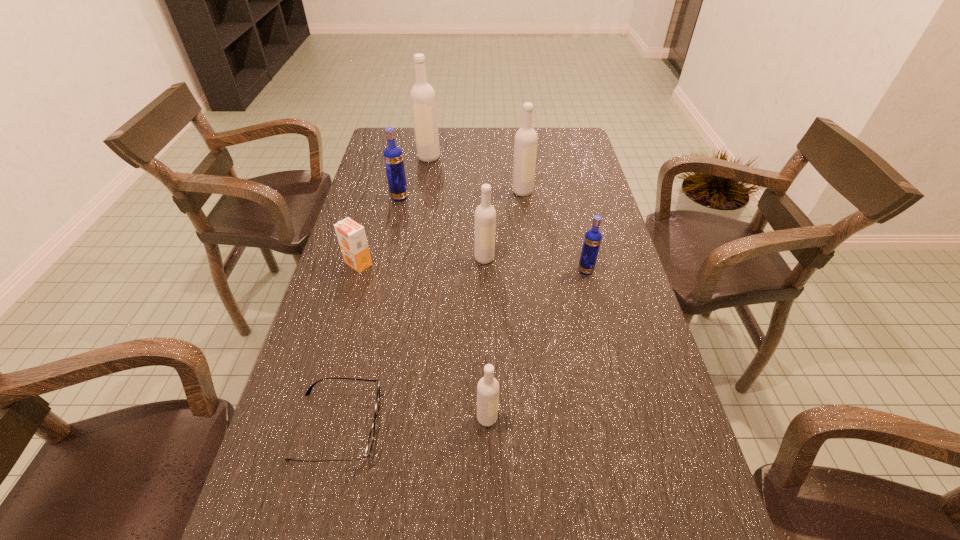
This screenshot has width=960, height=540. In order to click on the farthest vodka in this screenshot , I will do `click(423, 100)`.

Locate an element on the screen. the tallest vodka is located at coordinates (423, 100).

The width and height of the screenshot is (960, 540). What are the coordinates of `the second biggest white vodka` in the screenshot? It's located at (525, 145).

The image size is (960, 540). In order to click on the fifth vodka from left to right in this screenshot , I will do `click(525, 145)`.

You are a GUI agent. You are given a task and a screenshot of the screen. Output one action in this format:
    pyautogui.click(x=<x>, y=<y>)
    Task: Click on the farther blue vodka
    The width and height of the screenshot is (960, 540).
    Given the screenshot: What is the action you would take?
    pos(393,156)

You are a GUI agent. You are given a task and a screenshot of the screen. Output one action in this format:
    pyautogui.click(x=<x>, y=<y>)
    Task: Click on the leftmost vodka
    Image resolution: width=960 pixels, height=540 pixels.
    Given the screenshot: What is the action you would take?
    pyautogui.click(x=393, y=156)

This screenshot has height=540, width=960. Identify the location of the second smallest white vodka. (485, 214).

At what (x,y) coordinates should I click in order to perform the action: click on the right blue vodka. Please return your answer as a coordinate pair (x, y). This screenshot has height=540, width=960. Looking at the image, I should click on (592, 240).

Where is `the smaller blue vodka`? Image resolution: width=960 pixels, height=540 pixels. the smaller blue vodka is located at coordinates (592, 240).

Locate an element on the screen. The height and width of the screenshot is (540, 960). the nearest white vodka is located at coordinates (488, 387).